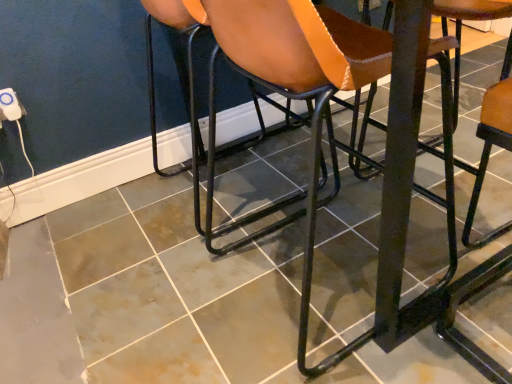
Where is `vacant region to the left of brown leather chair at center, the 1th chair from the left`? vacant region to the left of brown leather chair at center, the 1th chair from the left is located at coordinates (112, 227).